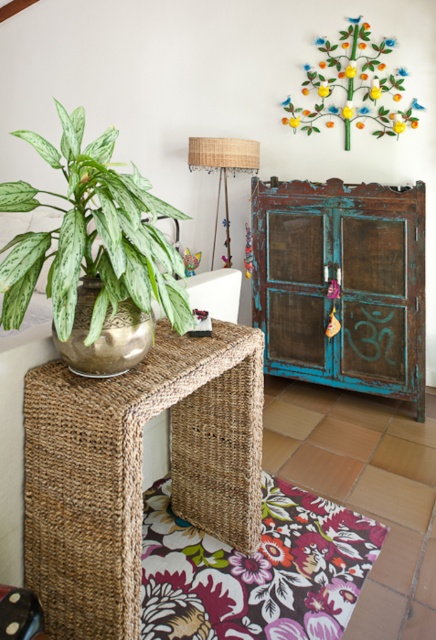
Question: Does woven seagrass side table at lower left have a smaller size compared to green variegated leaf at left?

Choices:
 (A) yes
 (B) no

Answer: (B)

Question: Does woven seagrass side table at lower left appear over metallic green tree at upper right?

Choices:
 (A) yes
 (B) no

Answer: (B)

Question: Which point is closer to the camera?

Choices:
 (A) (81, 618)
 (B) (225, 163)

Answer: (A)

Question: Where is teal distressed wood cabinet at center located in relation to woven fabric lampshade at center in the image?

Choices:
 (A) above
 (B) below

Answer: (B)

Question: Which of the following is the farthest from the observer?

Choices:
 (A) woven seagrass side table at lower left
 (B) green variegated leaf at left
 (C) woven fabric lampshade at center
 (D) metallic green tree at upper right

Answer: (C)

Question: Which object is positioned farthest from the metallic green tree at upper right?

Choices:
 (A) green variegated leaf at left
 (B) teal distressed wood cabinet at center
 (C) woven fabric lampshade at center

Answer: (A)